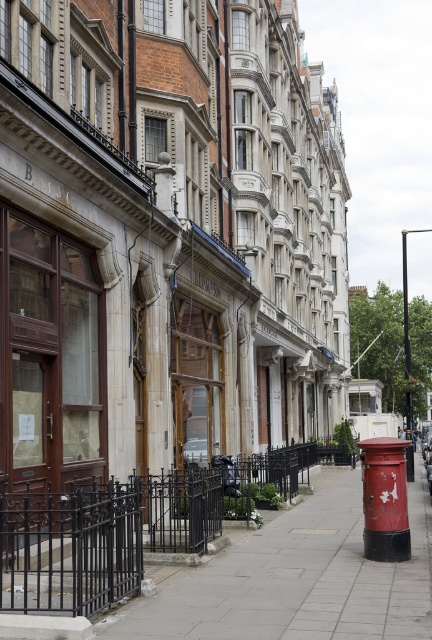
Question: Which point is closer to the camera taking this photo?

Choices:
 (A) (248, 476)
 (B) (298, 627)

Answer: (B)

Question: Is smooth concrete pavement at center to the right of black wrought iron fence at lower center from the viewer's perspective?

Choices:
 (A) no
 (B) yes

Answer: (B)

Question: Can you confirm if smooth concrete pavement at center is positioned below black wrought iron fence at lower center?

Choices:
 (A) no
 (B) yes

Answer: (B)

Question: Which point is closer to the camera?

Choices:
 (A) (425, 636)
 (B) (314, 445)

Answer: (A)

Question: Where is smooth concrete pavement at center located in relation to black wrought iron fence at lower center in the image?

Choices:
 (A) below
 (B) above

Answer: (A)